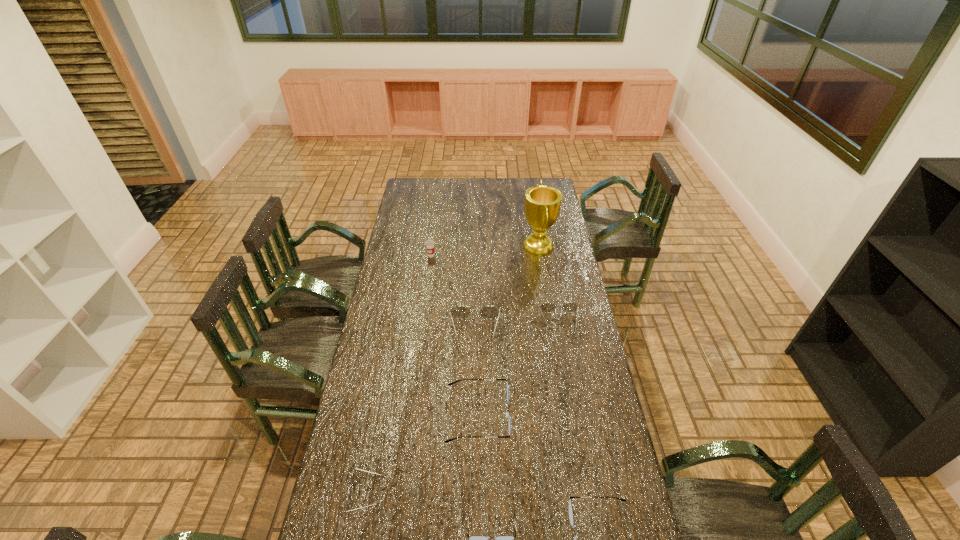
Identify the location of object that stands as the seventh closest to the fifth farthest object. This screenshot has width=960, height=540. (429, 243).

Where is `the second closest object to the second tallest object`? This screenshot has height=540, width=960. the second closest object to the second tallest object is located at coordinates (x=542, y=203).

Choose which spectacles is the nearest neighbor to the second yellow spectacles from left to right. Please provide its 2D coordinates. Your answer should be formatted as a tuple, i.e. [(x, y)], where the tuple contains the x and y coordinates of a point satisfying the conditions above.

[(547, 307)]

Locate which spectacles ranks fourth in proximity to the smallest yellow spectacles. Please provide its 2D coordinates. Your answer should be formatted as a tuple, i.e. [(x, y)], where the tuple contains the x and y coordinates of a point satisfying the conditions above.

[(571, 516)]

The height and width of the screenshot is (540, 960). Find the location of `yellow spectacles that can be found as the closest to the rightmost yellow spectacles`. yellow spectacles that can be found as the closest to the rightmost yellow spectacles is located at coordinates (460, 312).

Select which yellow spectacles is the closest to the nearest yellow spectacles. Please provide its 2D coordinates. Your answer should be formatted as a tuple, i.e. [(x, y)], where the tuple contains the x and y coordinates of a point satisfying the conditions above.

[(460, 312)]

Identify the location of the closest black spectacles to the golden award. (507, 414).

Locate an element on the screen. This screenshot has height=540, width=960. the closest black spectacles relative to the rightmost black spectacles is located at coordinates (473, 539).

I want to click on vacant region that satisfies the following two spatial constraints: 1. on the front-facing side of the rightmost yellow spectacles; 2. on the front-facing side of the smallest yellow spectacles, so click(x=589, y=494).